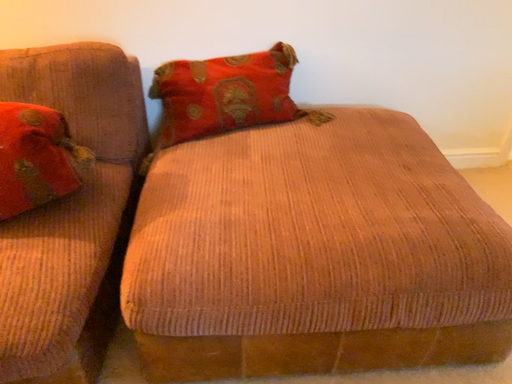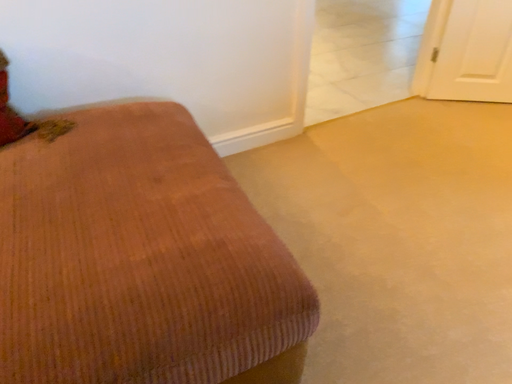
Question: Which way did the camera rotate in the video?

Choices:
 (A) rotated right
 (B) rotated left

Answer: (A)